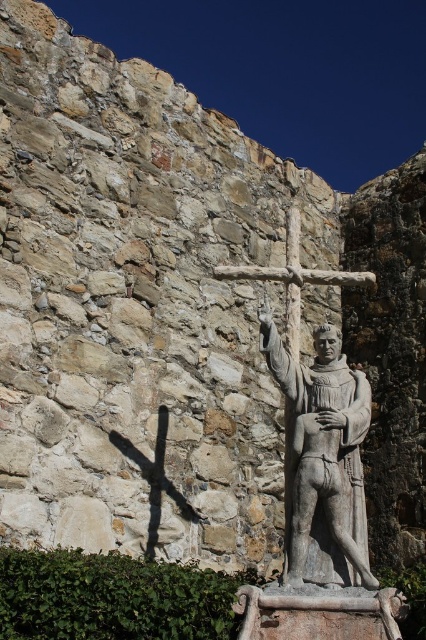
Question: Can you confirm if gray stone statue at center is positioned to the left of wooden cross at center?

Choices:
 (A) yes
 (B) no

Answer: (A)

Question: Which point is closer to the camera taking this photo?

Choices:
 (A) (340, 362)
 (B) (278, 269)

Answer: (A)

Question: Is gray stone statue at center smaller than wooden cross at center?

Choices:
 (A) yes
 (B) no

Answer: (A)

Question: Can you confirm if gray stone statue at center is positioned to the left of wooden cross at center?

Choices:
 (A) yes
 (B) no

Answer: (A)

Question: Which point is farther to the camera?

Choices:
 (A) gray stone statue at center
 (B) wooden cross at center

Answer: (B)